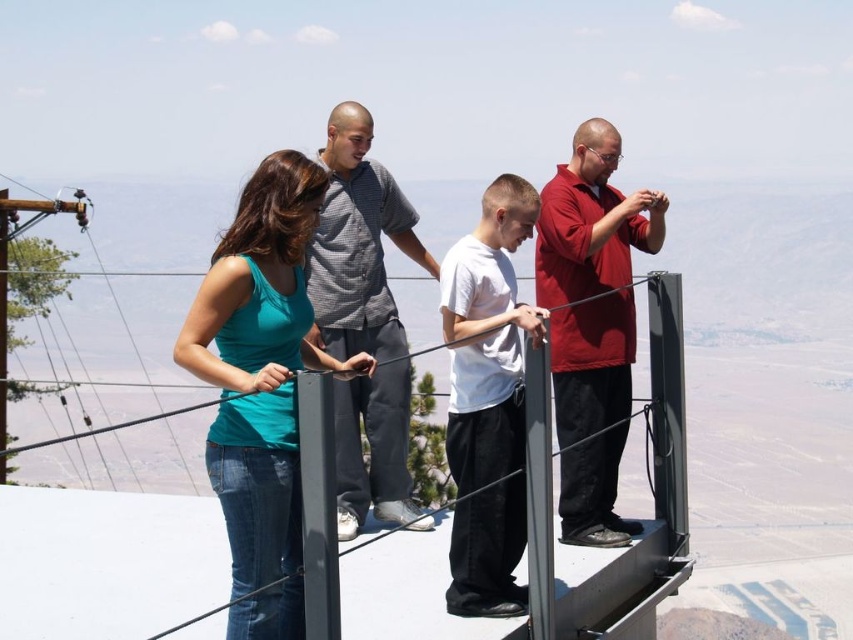
You are standing on the observation deck and want to hand a map to both the teal matte tank top at center and the white matte shirt at center. Which person should you approach first to ensure you can reach them without moving?

You should approach the teal matte tank top at center first because they are closer to you than the white matte shirt at center, so you can reach them without moving first.

You are a fashion designer analyzing the clothing in the scene. Which clothing item, the teal matte tank top at center or the matte red shirt at right, would you recommend for a client who prefers larger, more voluminous designs?

The teal matte tank top at center has a larger size compared to the matte red shirt at right, so it would be the better recommendation for a client preferring larger, more voluminous designs.